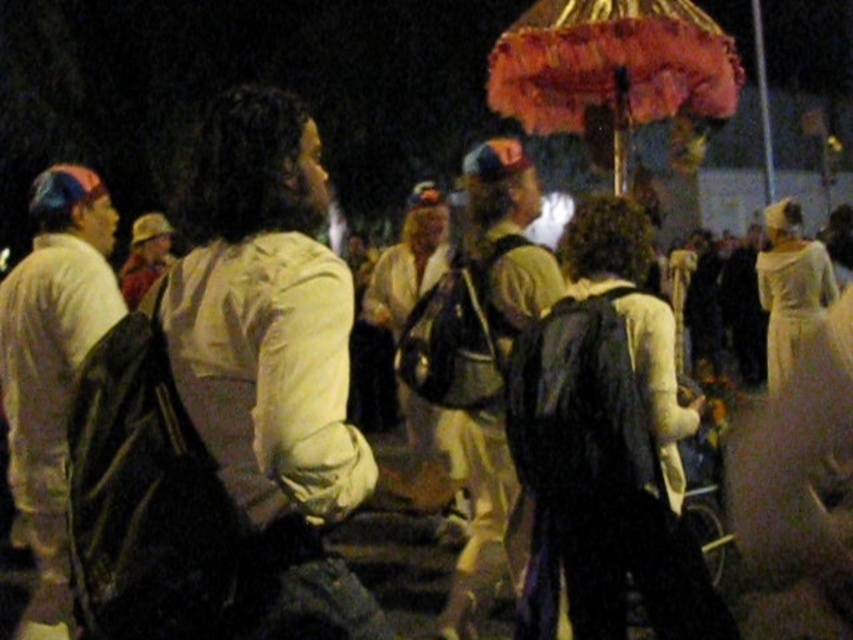
Question: In this image, where is matte black backpack at left located relative to velvet-like orange umbrella at upper center?

Choices:
 (A) left
 (B) right

Answer: (A)

Question: Which point is farther from the camera taking this photo?

Choices:
 (A) (9, 298)
 (B) (524, 118)

Answer: (B)

Question: Which of the following is the closest to the observer?

Choices:
 (A) (4, 356)
 (B) (248, 445)
 (C) (489, 436)
 (D) (701, 102)

Answer: (B)

Question: Can you confirm if matte black backpack at left is positioned above matte khaki shirt at center?

Choices:
 (A) yes
 (B) no

Answer: (A)

Question: Does white matte jacket at center appear over matte black backpack at left?

Choices:
 (A) no
 (B) yes

Answer: (B)

Question: Which point is closer to the camera?

Choices:
 (A) (88, 173)
 (B) (361, 586)
 (C) (537, 205)
 (D) (672, 65)

Answer: (B)